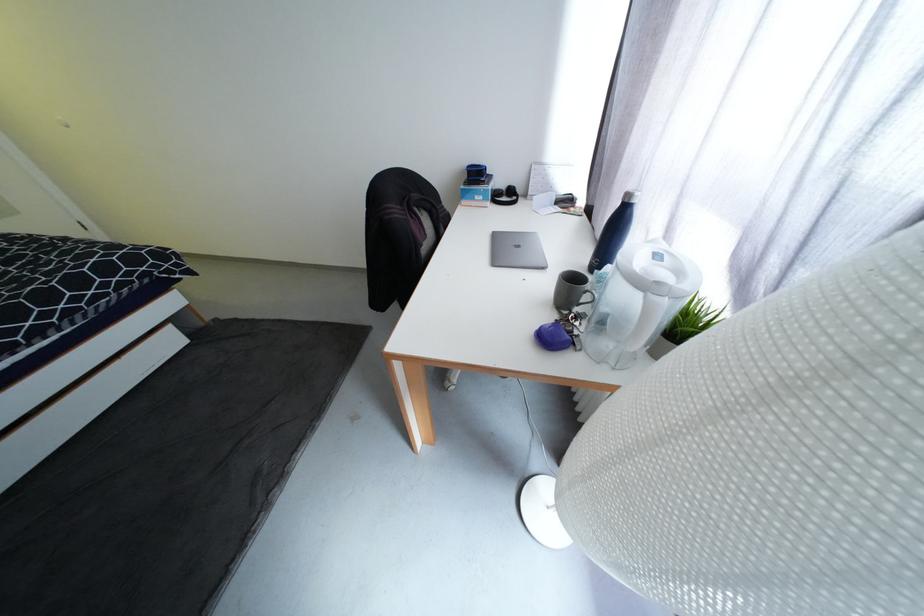
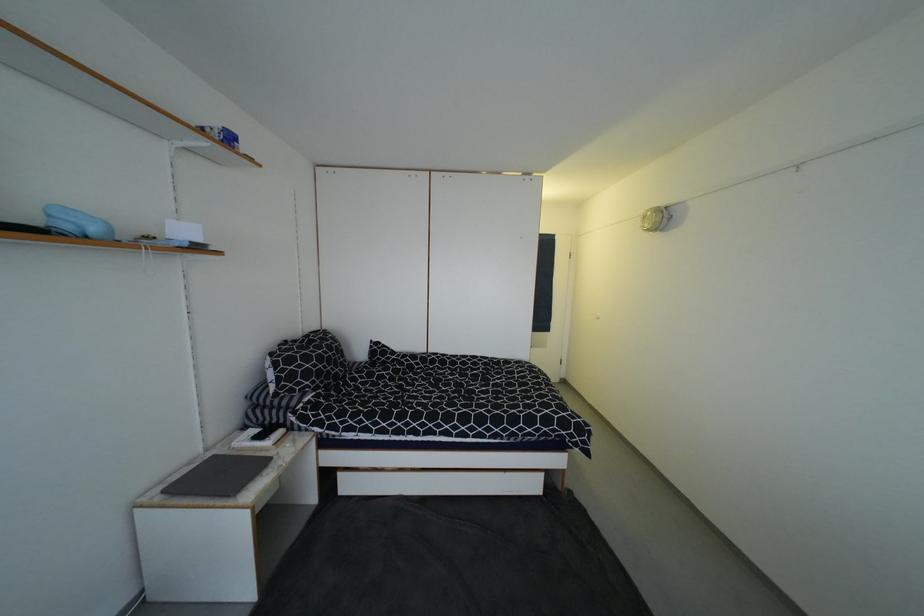
Question: Based on the continuous images, in which direction is the camera rotating? Reply with the corresponding letter.

Choices:
 (A) Left
 (B) Right
 (C) Up
 (D) Down

Answer: (A)